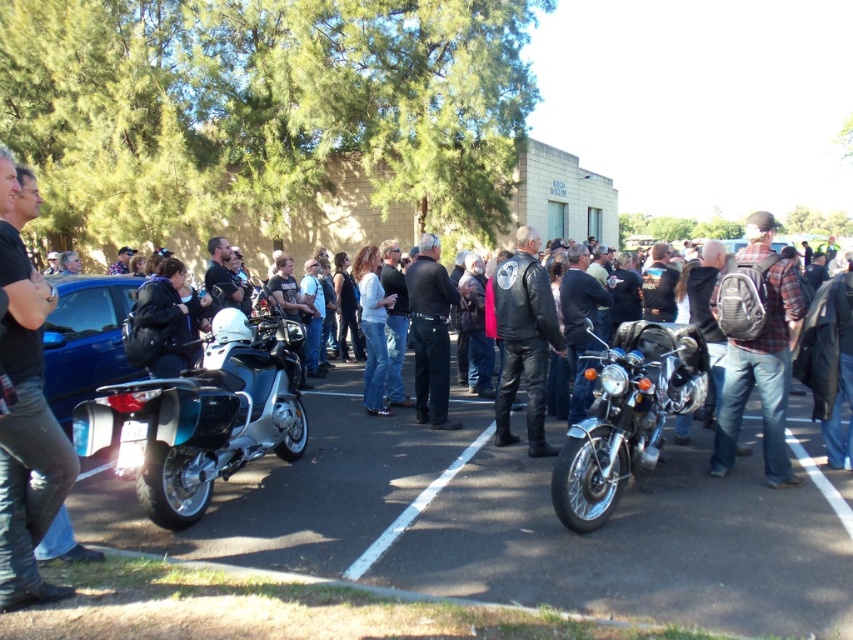
Who is more forward, (625, 378) or (439, 403)?

Positioned in front is point (625, 378).

Does shiny chrome motorcycle at center have a greater width compared to black leather jacket at center?

Indeed, shiny chrome motorcycle at center has a greater width compared to black leather jacket at center.

Where is `shiny chrome motorcycle at center`? shiny chrome motorcycle at center is located at coordinates click(x=625, y=417).

Which is more to the right, leather jacket at center or white painted line at center?

leather jacket at center is more to the right.

Which of these two, leather jacket at center or white painted line at center, stands shorter?

white painted line at center

Between point (515, 348) and point (492, 428), which one is positioned in front?

Positioned in front is point (515, 348).

Where is `leather jacket at center`? This screenshot has width=853, height=640. leather jacket at center is located at coordinates (524, 339).

Can you confirm if shiny metallic motorcycle at left is wider than black leather jacket at left?

Yes, shiny metallic motorcycle at left is wider than black leather jacket at left.

Does shiny metallic motorcycle at left appear on the right side of black leather jacket at left?

Indeed, shiny metallic motorcycle at left is positioned on the right side of black leather jacket at left.

What do you see at coordinates (202, 417) in the screenshot? The width and height of the screenshot is (853, 640). I see `shiny metallic motorcycle at left` at bounding box center [202, 417].

You are a GUI agent. You are given a task and a screenshot of the screen. Output one action in this format:
    pyautogui.click(x=<x>, y=<y>)
    Task: Click on the shiny metallic motorcycle at left
    
    Given the screenshot: What is the action you would take?
    pyautogui.click(x=202, y=417)